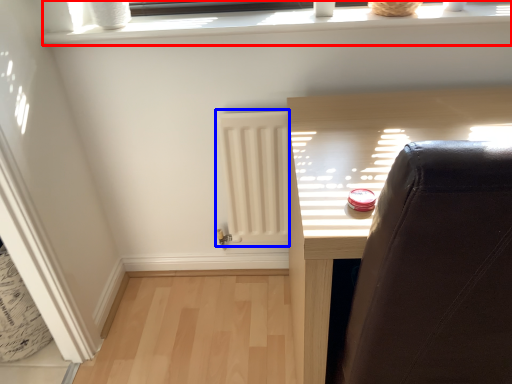
Question: Among these objects, which one is nearest to the camera, window frame (highlighted by a red box) or radiator (highlighted by a blue box)?

Choices:
 (A) window frame
 (B) radiator

Answer: (A)